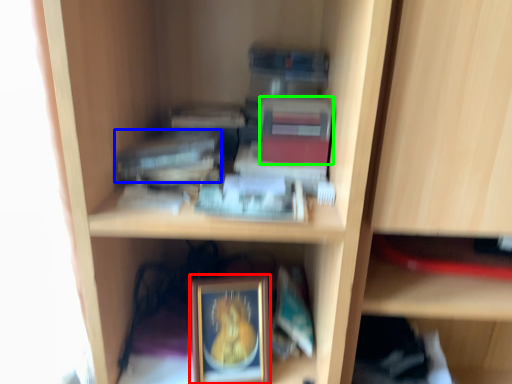
Question: Based on their relative distances, which object is nearer to picture frame (highlighted by a red box)? Choose from paperback book (highlighted by a blue box) and paperback book (highlighted by a green box).

Choices:
 (A) paperback book
 (B) paperback book

Answer: (A)